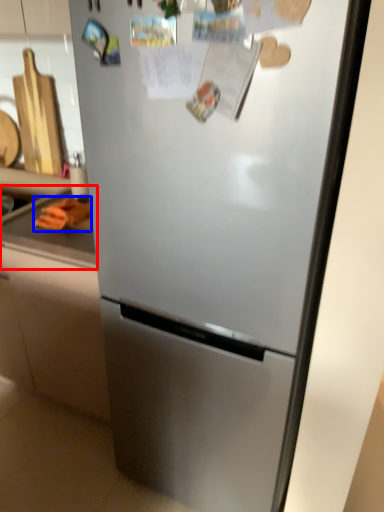
Question: Which object appears closest to the camera in this image, counter top (highlighted by a red box) or food (highlighted by a blue box)?

Choices:
 (A) counter top
 (B) food

Answer: (B)